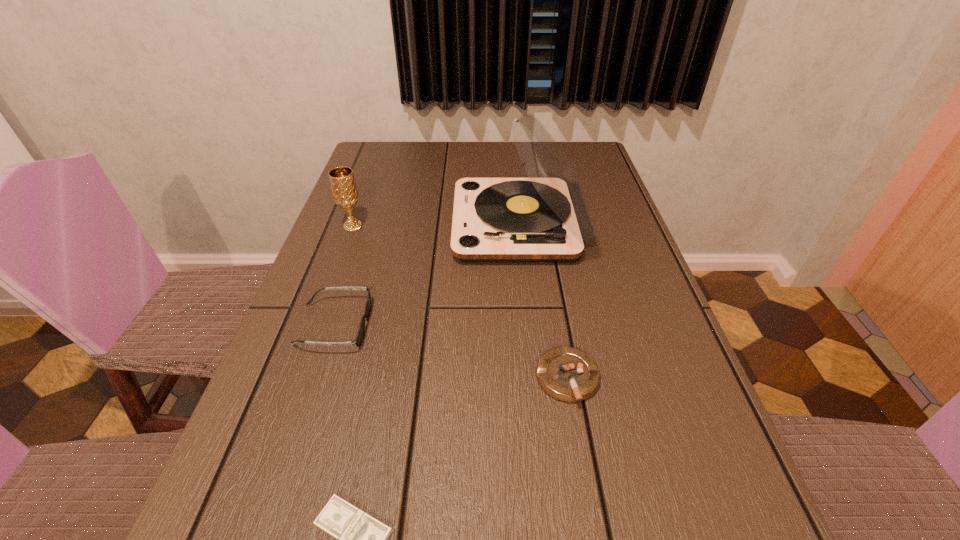
At what (x,y) coordinates should I click in order to perform the action: click on chalice at the left edge. Please return your answer as a coordinate pair (x, y). The image size is (960, 540). Looking at the image, I should click on pyautogui.click(x=345, y=194).

This screenshot has width=960, height=540. Identify the location of sunglasses located in the left edge section of the desktop. (358, 339).

I want to click on object located in the right edge section of the desktop, so click(544, 218).

You are a GUI agent. You are given a task and a screenshot of the screen. Output one action in this format:
    pyautogui.click(x=<x>, y=<y>)
    Task: Click on the vacant space at the far edge
    
    Given the screenshot: What is the action you would take?
    [x=517, y=170]

The width and height of the screenshot is (960, 540). I want to click on vacant area at the left edge, so click(x=387, y=215).

Locate an element on the screen. vacant point at the right edge is located at coordinates (651, 482).

The image size is (960, 540). I want to click on vacant space that is in between the ashtray and the sunglasses, so click(450, 352).

Locate an element on the screen. vacant space that is in between the sunglasses and the ashtray is located at coordinates (450, 352).

Where is `free space between the third shortest object and the tallest object`? This screenshot has height=540, width=960. free space between the third shortest object and the tallest object is located at coordinates (426, 275).

Find the location of a particular element. The image size is (960, 540). object that stands as the fourth closest to the money is located at coordinates click(x=345, y=194).